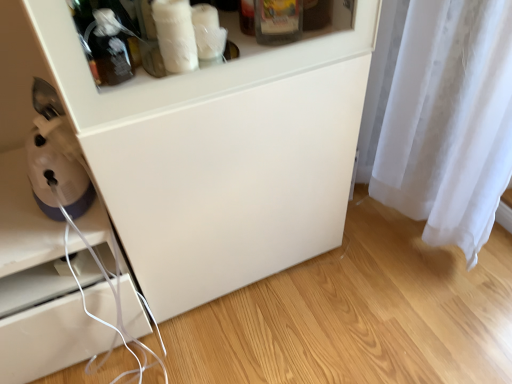
From the picture: In order to face white plastic vacuum cleaner at lower left, should I rotate leftwards or rightwards?

You should rotate left by 25.256 degrees.

What do you see at coordinates (57, 169) in the screenshot? The width and height of the screenshot is (512, 384). I see `white plastic vacuum cleaner at lower left` at bounding box center [57, 169].

Locate an element on the screen. white plastic vacuum cleaner at lower left is located at coordinates (57, 169).

The image size is (512, 384). Find the location of `white plastic vacuum cleaner at lower left`. white plastic vacuum cleaner at lower left is located at coordinates [57, 169].